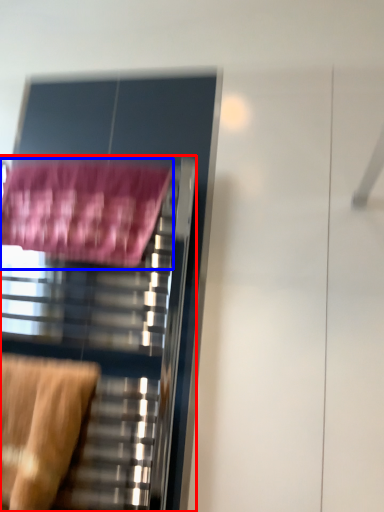
Question: Among these objects, which one is farthest to the camera, furniture (highlighted by a red box) or bath towel (highlighted by a blue box)?

Choices:
 (A) furniture
 (B) bath towel

Answer: (B)